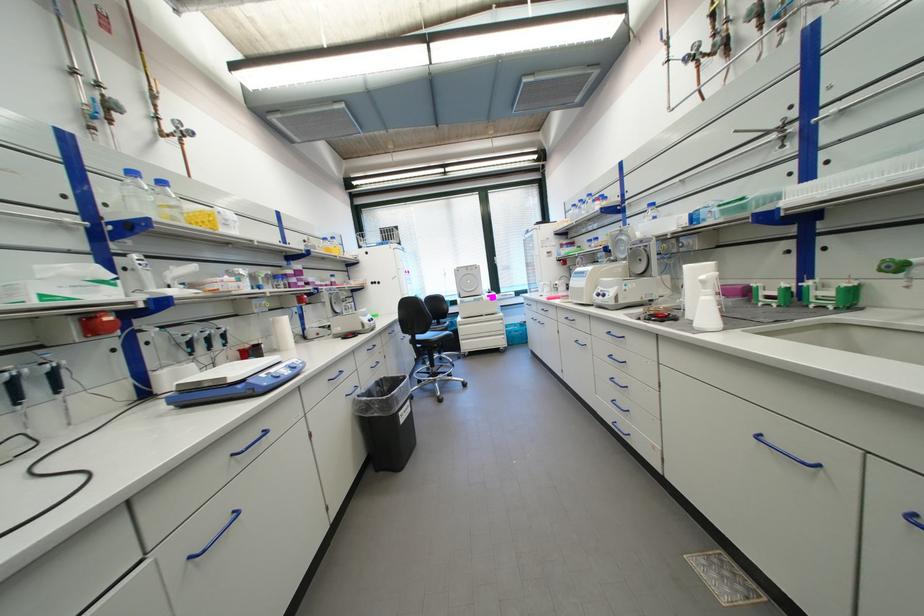
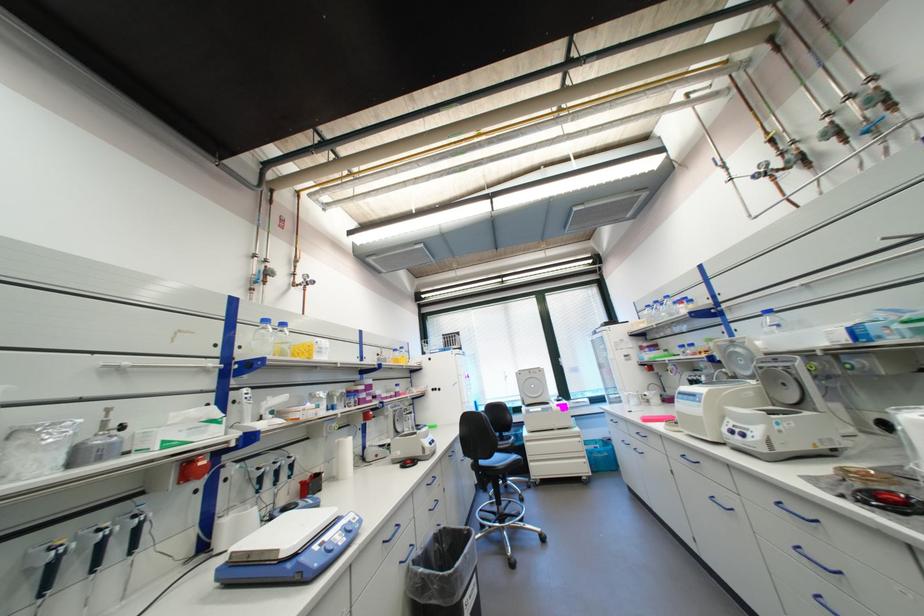
Where in the second image is the point corresponding to point (653, 246) from the first image?

(796, 369)